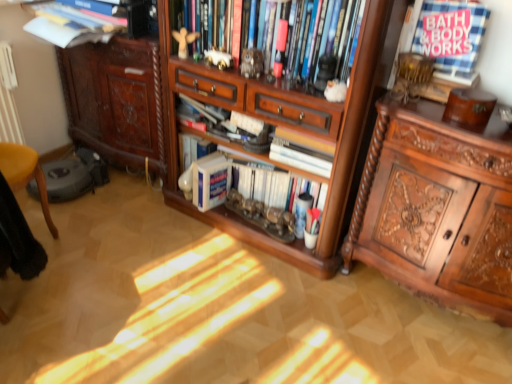
The image size is (512, 384). Describe the element at coordinates (335, 91) in the screenshot. I see `white fluffy toy at upper center, which ranks as the fourth toy in left-to-right order` at that location.

What do you see at coordinates (451, 37) in the screenshot?
I see `white checkered fabric at upper right, positioned as the second book in top-to-bottom order` at bounding box center [451, 37].

The image size is (512, 384). Identify the location of wooden cabinet at center. [x=291, y=129].

Is wooden cabinet at center far away from white porcelain elephant at upper center, the second toy positioned from the left?

wooden cabinet at center is actually quite close to white porcelain elephant at upper center, the second toy positioned from the left.

From a real-world perspective, is wooden cabinet at center located beneath white porcelain elephant at upper center, the third toy when ordered from front to back?

Yes.

The image size is (512, 384). Find the location of `cabinet that appears in front of the white porcelain elephant at upper center, the second toy positioned from the left`. cabinet that appears in front of the white porcelain elephant at upper center, the second toy positioned from the left is located at coordinates tap(291, 129).

Is white porcelain elephant at upper center, the second toy positioned from the left, at the back of wooden cabinet at center?

Yes, white porcelain elephant at upper center, the second toy positioned from the left, is at the back of wooden cabinet at center.

Which is behind, point (65, 73) or point (298, 25)?

The point (65, 73) is farther from the camera.

Considering the sizes of objects brown carved cabinet at left, arranged as the first cabinetry when viewed from the left, and wooden bookshelf at upper center, positioned as the first book in top-to-bottom order, in the image provided, who is shorter, brown carved cabinet at left, arranged as the first cabinetry when viewed from the left, or wooden bookshelf at upper center, positioned as the first book in top-to-bottom order,?

wooden bookshelf at upper center, positioned as the first book in top-to-bottom order.

Consider the image. Is brown carved cabinet at left, acting as the second cabinetry starting from the right, facing towards wooden bookshelf at upper center, positioned as the first book in top-to-bottom order?

No, brown carved cabinet at left, acting as the second cabinetry starting from the right, is not aimed at wooden bookshelf at upper center, positioned as the first book in top-to-bottom order.

Visually, is polished wood cabinet at right, the second cabinetry positioned from the left, positioned to the left or to the right of white fluffy toy at upper center, arranged as the fourth toy when viewed from the back?

From the image, it's evident that polished wood cabinet at right, the second cabinetry positioned from the left, is to the right of white fluffy toy at upper center, arranged as the fourth toy when viewed from the back.

From a real-world perspective, is polished wood cabinet at right, the second cabinetry positioned from the left, located higher than white fluffy toy at upper center, acting as the first toy starting from the front?

Incorrect, from a real-world perspective, polished wood cabinet at right, the second cabinetry positioned from the left, is lower than white fluffy toy at upper center, acting as the first toy starting from the front.

How different are the orientations of polished wood cabinet at right, the 1th cabinetry positioned from the right, and white fluffy toy at upper center, arranged as the first toy when viewed from the right, in degrees?

The facing directions of polished wood cabinet at right, the 1th cabinetry positioned from the right, and white fluffy toy at upper center, arranged as the first toy when viewed from the right, are 1.34 degrees apart.

Between point (474, 190) and point (341, 87), which one is positioned in front?

The point (474, 190) is in front.

Looking at this image, does wooden cabinet at center have a greater height compared to polished wood cabinet at right, the 1th cabinetry positioned from the right?

Correct, wooden cabinet at center is much taller as polished wood cabinet at right, the 1th cabinetry positioned from the right.

Is wooden cabinet at center to the right of polished wood cabinet at right, the 1th cabinetry positioned from the right, from the viewer's perspective?

In fact, wooden cabinet at center is to the left of polished wood cabinet at right, the 1th cabinetry positioned from the right.

Is wooden cabinet at center located outside polished wood cabinet at right, the 1th cabinetry positioned from the right?

That's correct, wooden cabinet at center is outside of polished wood cabinet at right, the 1th cabinetry positioned from the right.

Does point (244, 162) lie in front of point (206, 51)?

No, (244, 162) is behind (206, 51).

Is hardcover book at center, which is the second book in bottom-to-top order, far away from white porcelain elephant at upper center, which is the second toy from back to front?

No, hardcover book at center, which is the second book in bottom-to-top order, is not far away from white porcelain elephant at upper center, which is the second toy from back to front.

Is hardcover book at center, the fourth book from the top, inside or outside of white porcelain elephant at upper center, the third toy when ordered from front to back?

hardcover book at center, the fourth book from the top, is outside white porcelain elephant at upper center, the third toy when ordered from front to back.

Between point (331, 86) and point (319, 146), which one is positioned in front?

The point (331, 86) is closer.

From a real-world perspective, is white fluffy toy at upper center, arranged as the first toy when viewed from the right, positioned under white paper at center, which is the third book in top-to-bottom order, based on gravity?

No.

Is white fluffy toy at upper center, arranged as the fourth toy when viewed from the back, wider or thinner than white paper at center, which is counted as the third book, starting from the bottom?

white fluffy toy at upper center, arranged as the fourth toy when viewed from the back, is thinner than white paper at center, which is counted as the third book, starting from the bottom.

Is white fluffy toy at upper center, which ranks as the fourth toy in left-to-right order, oriented towards white paper at center, which is counted as the third book, starting from the bottom?

No, white fluffy toy at upper center, which ranks as the fourth toy in left-to-right order, is not aimed at white paper at center, which is counted as the third book, starting from the bottom.

Would you consider white checkered fabric at upper right, placed as the fourth book when sorted from bottom to top, to be distant from white porcelain elephant at upper center, the third toy when ordered from front to back?

white checkered fabric at upper right, placed as the fourth book when sorted from bottom to top, is actually quite close to white porcelain elephant at upper center, the third toy when ordered from front to back.

Which is behind, point (442, 1) or point (210, 50)?

The point (210, 50) is farther from the camera.

Do you think white checkered fabric at upper right, positioned as the second book in top-to-bottom order, is within white porcelain elephant at upper center, which appears as the third toy when viewed from the right, or outside of it?

white checkered fabric at upper right, positioned as the second book in top-to-bottom order, is not inside white porcelain elephant at upper center, which appears as the third toy when viewed from the right, it's outside.

Looking at this image, considering the relative sizes of white checkered fabric at upper right, placed as the fourth book when sorted from bottom to top, and white porcelain elephant at upper center, which is the second toy from back to front, in the image provided, is white checkered fabric at upper right, placed as the fourth book when sorted from bottom to top, thinner than white porcelain elephant at upper center, which is the second toy from back to front,?

No, white checkered fabric at upper right, placed as the fourth book when sorted from bottom to top, is not thinner than white porcelain elephant at upper center, which is the second toy from back to front.

Locate an element on the screen. The width and height of the screenshot is (512, 384). cabinet that is under the white porcelain elephant at upper center, the second toy positioned from the left (from a real-world perspective) is located at coordinates (291, 129).

The width and height of the screenshot is (512, 384). I want to click on the 1st cabinetry below when counting from the wooden bookshelf at upper center, which appears as the fifth book when ordered from the bottom (from the image's perspective), so click(x=116, y=99).

Based on their spatial positions, is hardcover book at center, which is the second book in bottom-to-top order, or brown carved cabinet at left, arranged as the first cabinetry when viewed from the left, further from white fluffy toy at upper center, arranged as the first toy when viewed from the right?

brown carved cabinet at left, arranged as the first cabinetry when viewed from the left, is further to white fluffy toy at upper center, arranged as the first toy when viewed from the right.

Estimate the real-world distances between objects in this image. Which object is closer to wooden bookshelf at upper center, which appears as the fifth book when ordered from the bottom, wooden cabinet at center or white paper at center, which is the third book in top-to-bottom order?

wooden cabinet at center.

Based on their spatial positions, is white paper at center, which is the third book in top-to-bottom order, or white matte book at center, which ranks as the first book in bottom-to-top order, further from brown carved cabinet at left, arranged as the first cabinetry when viewed from the left?

white paper at center, which is the third book in top-to-bottom order.

When comparing their distances from white matte book at center, arranged as the 5th book when viewed from the top, does white fluffy toy at upper center, which ranks as the fourth toy in left-to-right order, or white porcelain elephant at upper center, the second toy positioned from the left, seem further?

Based on the image, white fluffy toy at upper center, which ranks as the fourth toy in left-to-right order, appears to be further to white matte book at center, arranged as the 5th book when viewed from the top.

When comparing their distances from wooden bookshelf at upper center, which appears as the fifth book when ordered from the bottom, does wooden cabinet at center or white checkered fabric at upper right, placed as the fourth book when sorted from bottom to top, seem further?

white checkered fabric at upper right, placed as the fourth book when sorted from bottom to top, is positioned further to the anchor wooden bookshelf at upper center, which appears as the fifth book when ordered from the bottom.

When comparing their distances from white matte book at center, arranged as the 5th book when viewed from the top, does white paper at center, which is the third book in top-to-bottom order, or white fluffy toy at upper center, which ranks as the fourth toy in left-to-right order, seem closer?

white paper at center, which is the third book in top-to-bottom order, lies closer to white matte book at center, arranged as the 5th book when viewed from the top, than the other object.

Consider the image. From the image, which object appears to be farther from hardcover book at center, the fourth book from the top, wooden angel at upper center, the first toy when ordered from back to front, or white checkered fabric at upper right, placed as the fourth book when sorted from bottom to top?

Based on the image, white checkered fabric at upper right, placed as the fourth book when sorted from bottom to top, appears to be further to hardcover book at center, the fourth book from the top.

Based on their spatial positions, is polished wood cabinet at right, the second cabinetry positioned from the left, or white porcelain elephant at upper center, the third toy when ordered from front to back, further from hardcover book at center, the fourth book from the top?

white porcelain elephant at upper center, the third toy when ordered from front to back.

The width and height of the screenshot is (512, 384). I want to click on book between brown carved cabinet at left, arranged as the first cabinetry when viewed from the left, and metallic statue at center, the 3th toy when ordered from left to right, from left to right, so click(x=211, y=181).

Where is `toy between white porcelain elephant at upper center, the second toy positioned from the left, and white paper at center, which is the third book in top-to-bottom order`? toy between white porcelain elephant at upper center, the second toy positioned from the left, and white paper at center, which is the third book in top-to-bottom order is located at coordinates (252, 63).

At what (x,y) coordinates should I click in order to perform the action: click on toy situated between wooden angel at upper center, the first toy when ordered from back to front, and metallic statue at center, the 3th toy when ordered from left to right, from left to right. Please return your answer as a coordinate pair (x, y). The width and height of the screenshot is (512, 384). Looking at the image, I should click on (218, 59).

I want to click on toy situated between hardcover book at center, the fourth book from the top, and white checkered fabric at upper right, positioned as the second book in top-to-bottom order, from left to right, so (x=335, y=91).